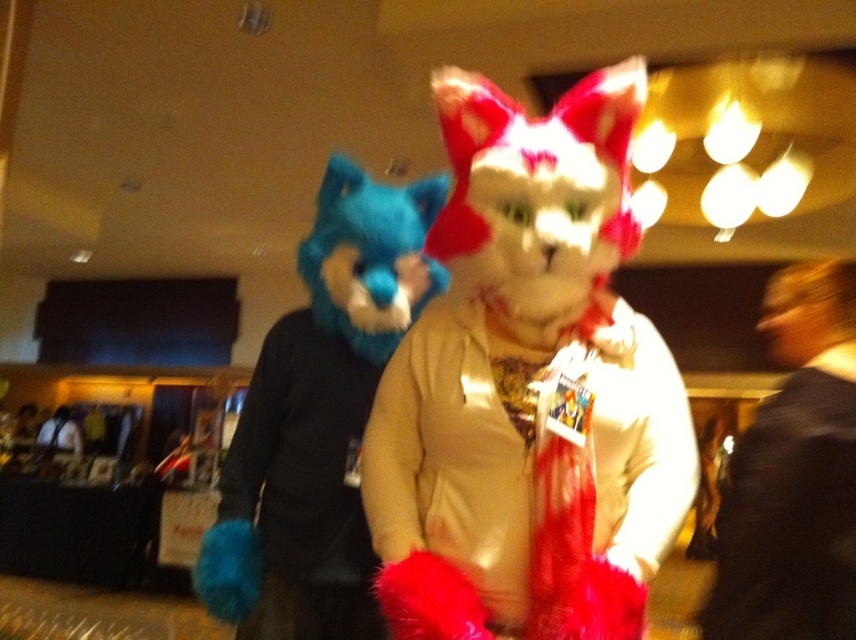
Question: Does fuzzy blue glove at left appear over black fuzzy coat at right?

Choices:
 (A) no
 (B) yes

Answer: (B)

Question: Which point is closer to the camera?

Choices:
 (A) black fuzzy coat at right
 (B) fuzzy blue glove at left
 (C) fuzzy white scarf at center

Answer: (C)

Question: Can you confirm if fuzzy white scarf at center is smaller than fuzzy blue glove at left?

Choices:
 (A) no
 (B) yes

Answer: (A)

Question: Which point is closer to the camera?

Choices:
 (A) (849, 614)
 (B) (516, 344)
 (C) (299, 348)

Answer: (B)

Question: Does fuzzy white scarf at center have a greater width compared to fuzzy blue glove at left?

Choices:
 (A) no
 (B) yes

Answer: (B)

Question: Among these points, which one is farthest from the camera?

Choices:
 (A) (620, 412)
 (B) (239, 528)

Answer: (B)